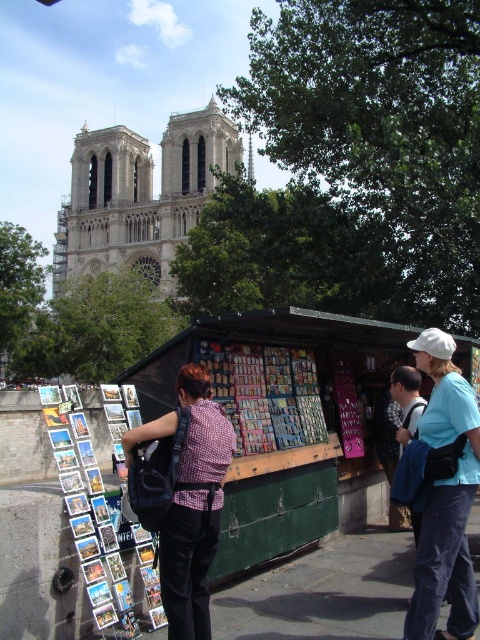
Question: Does plaid shirt at center have a lesser width compared to matte white cap at upper right?

Choices:
 (A) no
 (B) yes

Answer: (A)

Question: Is plaid shirt at center thinner than matte white cap at upper right?

Choices:
 (A) yes
 (B) no

Answer: (B)

Question: Which object is farther from the camera taking this photo?

Choices:
 (A) plaid shirt at center
 (B) stone gothic cathedral at upper left
 (C) matte white cap at upper right

Answer: (B)

Question: Which is nearer to the plaid shirt at center?

Choices:
 (A) matte white cap at upper right
 (B) stone gothic cathedral at upper left

Answer: (A)

Question: Can you confirm if plaid shirt at center is positioned below matte white cap at upper right?

Choices:
 (A) no
 (B) yes

Answer: (B)

Question: Considering the real-world distances, which object is farthest from the stone gothic cathedral at upper left?

Choices:
 (A) matte white cap at upper right
 (B) plaid shirt at center

Answer: (A)